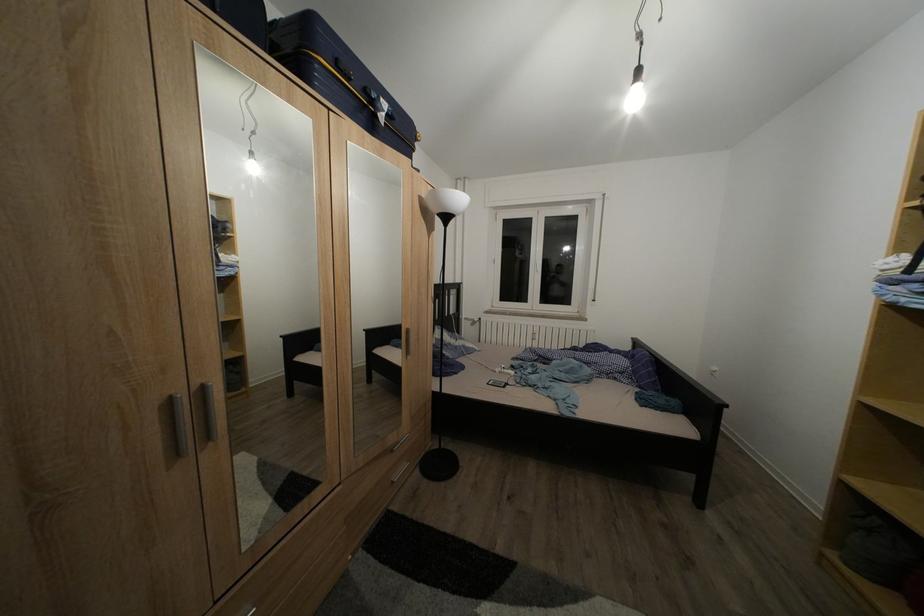
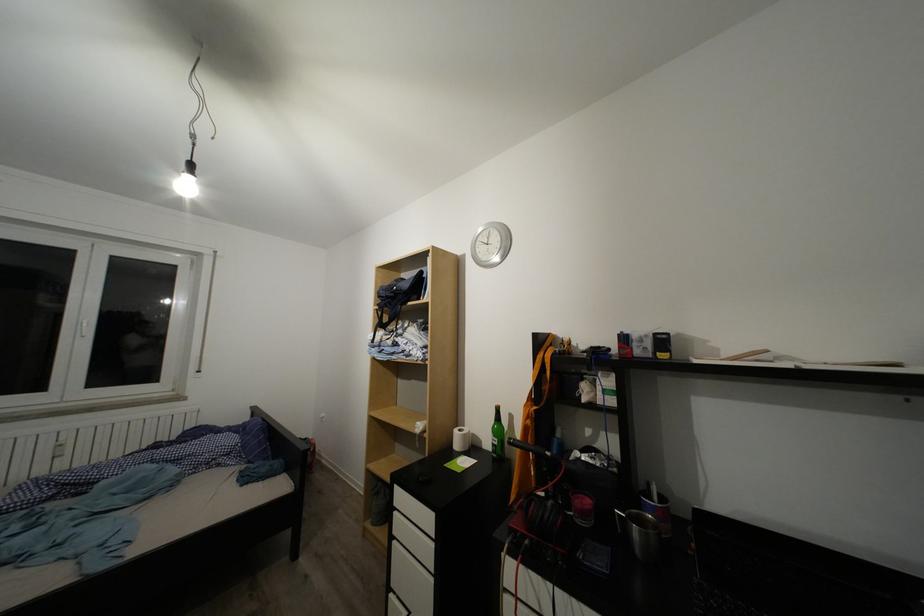
Question: The camera is either moving clockwise (left) or counter-clockwise (right) around the object. The first image is from the beginning of the video and the second image is from the end. Is the camera moving left or right when shooting the video?

Choices:
 (A) Left
 (B) Right

Answer: (A)